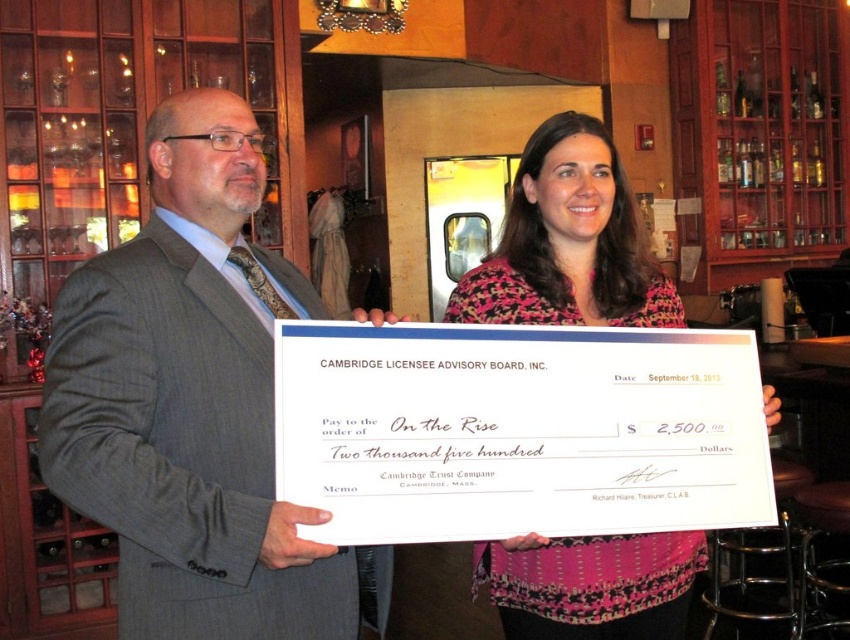
Question: Does gray pinstripe suit at center lie in front of pink floral blouse at center?

Choices:
 (A) no
 (B) yes

Answer: (B)

Question: Is gray pinstripe suit at center bigger than pink floral blouse at center?

Choices:
 (A) no
 (B) yes

Answer: (B)

Question: Can you confirm if gray pinstripe suit at center is positioned below pink floral blouse at center?

Choices:
 (A) yes
 (B) no

Answer: (A)

Question: Which point is closer to the camera taking this photo?

Choices:
 (A) (552, 116)
 (B) (235, 125)

Answer: (B)